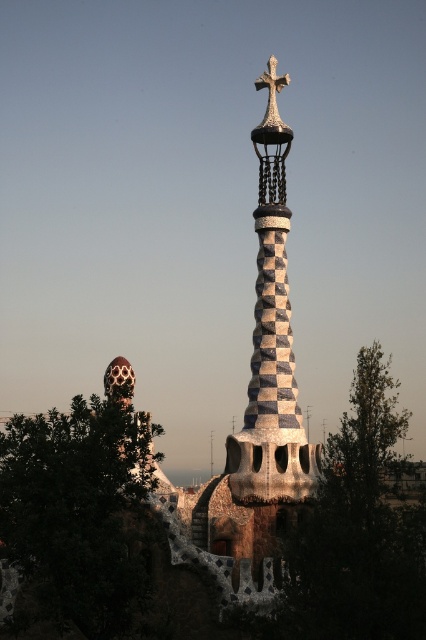
Question: Which point is farther to the camera?

Choices:
 (A) (262, 76)
 (B) (282, 380)

Answer: (A)

Question: Where is speckled ceramic spire at center located in relation to white stone cross at upper center in the image?

Choices:
 (A) below
 (B) above

Answer: (A)

Question: Does speckled ceramic spire at center have a lesser width compared to white stone cross at upper center?

Choices:
 (A) no
 (B) yes

Answer: (A)

Question: Does speckled ceramic spire at center appear on the left side of white stone cross at upper center?

Choices:
 (A) yes
 (B) no

Answer: (A)